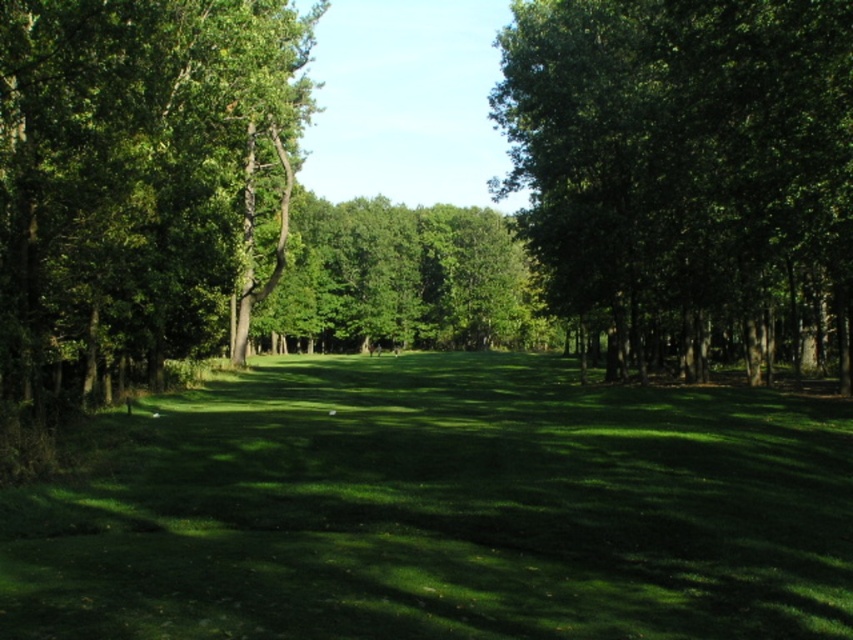
You are standing in the forest clearing and want to place a small bench between the two points, point (74,90) and point (505,342). Which point should the bench be closer to so that it is nearer to the viewer?

The bench should be placed closer to point (74,90) because it is closer to the viewer than point (505,342).

You are a hiker trying to cross the clearing. You notice the green grass at center and the green leafy tree at center. Which of these two objects is narrower in width?

The green grass at center is thinner than the green leafy tree at center, so the green grass at center is narrower in width.

You are standing in the forest clearing and want to walk from the green leafy tree at left to the green leafy tree at center. Which direction should you face to walk directly towards the tree?

You should face to the right because the green leafy tree at center is to the right of the green leafy tree at left.